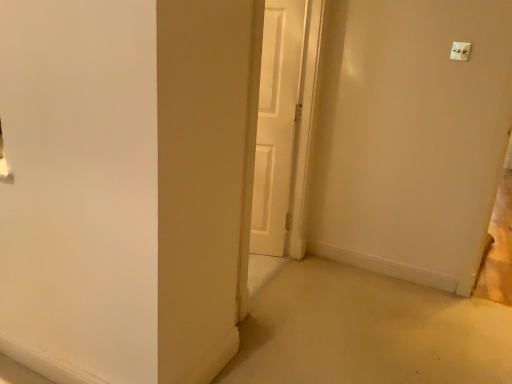
Question: From a real-world perspective, is white matte door at center under white plastic light switch at upper right?

Choices:
 (A) no
 (B) yes

Answer: (B)

Question: Considering the relative sizes of white matte door at center and white plastic light switch at upper right in the image provided, is white matte door at center wider than white plastic light switch at upper right?

Choices:
 (A) no
 (B) yes

Answer: (A)

Question: From a real-world perspective, is white matte door at center on top of white plastic light switch at upper right?

Choices:
 (A) no
 (B) yes

Answer: (A)

Question: Considering the relative positions of white matte door at center and white plastic light switch at upper right in the image provided, is white matte door at center to the right of white plastic light switch at upper right from the viewer's perspective?

Choices:
 (A) yes
 (B) no

Answer: (B)

Question: Can you confirm if white matte door at center is positioned to the left of white plastic light switch at upper right?

Choices:
 (A) yes
 (B) no

Answer: (A)

Question: Does white matte door at center have a greater height compared to white plastic light switch at upper right?

Choices:
 (A) yes
 (B) no

Answer: (A)

Question: Considering the relative positions of white plastic light switch at upper right and white matte door at center in the image provided, is white plastic light switch at upper right to the left of white matte door at center from the viewer's perspective?

Choices:
 (A) no
 (B) yes

Answer: (A)

Question: Can you confirm if white plastic light switch at upper right is thinner than white matte door at center?

Choices:
 (A) yes
 (B) no

Answer: (B)

Question: Can you confirm if white plastic light switch at upper right is positioned to the right of white matte door at center?

Choices:
 (A) yes
 (B) no

Answer: (A)

Question: From the image's perspective, does white plastic light switch at upper right appear higher than white matte door at center?

Choices:
 (A) yes
 (B) no

Answer: (A)

Question: Does white plastic light switch at upper right lie behind white matte door at center?

Choices:
 (A) no
 (B) yes

Answer: (A)

Question: Considering the relative sizes of white plastic light switch at upper right and white matte door at center in the image provided, is white plastic light switch at upper right bigger than white matte door at center?

Choices:
 (A) yes
 (B) no

Answer: (B)

Question: Based on their positions, is white plastic light switch at upper right located to the left or right of white matte door at center?

Choices:
 (A) right
 (B) left

Answer: (A)